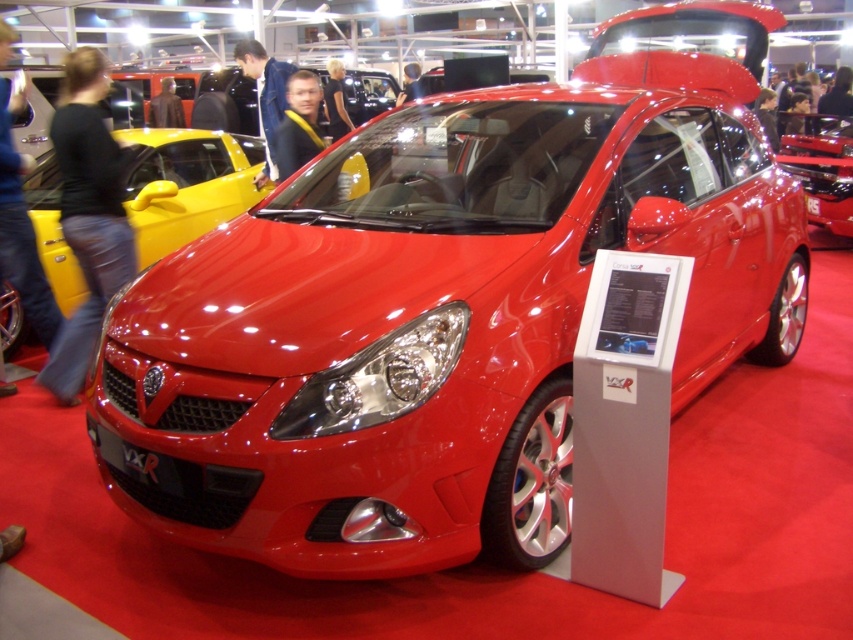
Question: Is glossy yellow car at upper left to the left of glossy red car at center from the viewer's perspective?

Choices:
 (A) no
 (B) yes

Answer: (B)

Question: Among these objects, which one is nearest to the camera?

Choices:
 (A) brown leather jacket at upper center
 (B) blue denim jacket at center

Answer: (B)

Question: Which point appears farthest from the camera in this image?

Choices:
 (A) (799, 116)
 (B) (418, 68)

Answer: (B)

Question: From the image, what is the correct spatial relationship of jeans at center in relation to blonde hair at upper left?

Choices:
 (A) left
 (B) right

Answer: (A)

Question: Which object is farther from the camera taking this photo?

Choices:
 (A) black leather jacket at center
 (B) matte black camera at upper center
 (C) matte black jacket at center
 (D) blonde hair at upper left

Answer: (B)

Question: Is glossy yellow car at upper left above blue denim jacket at center?

Choices:
 (A) yes
 (B) no

Answer: (B)